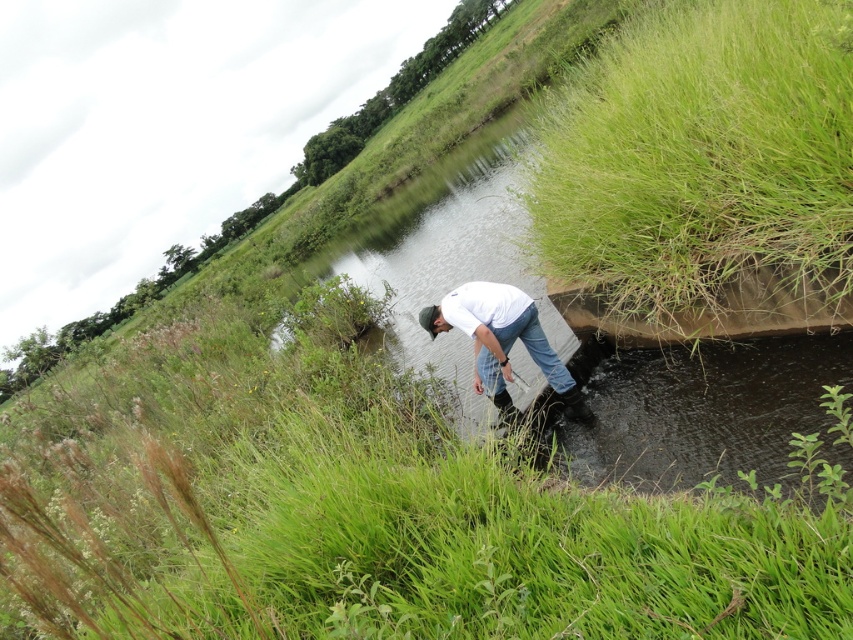
From the picture: You are a photographer trying to capture the scene of the person by the water. To ensure both the white matte shirt at center and the blue denim jeans at lower center are visible in the frame, which part of the person should you focus on?

You should focus on the white matte shirt at center because it is positioned on the left side of the blue denim jeans at lower center, making both elements visible in the frame.

You are a hiker who wants to cross the water body in the scene. You see the green grassy bank at upper right and the blue denim jeans at lower center. Which direction should you head towards to reach the bank?

You should head towards the green grassy bank at upper right because it is located above the blue denim jeans at lower center, indicating it is a higher elevation and likely the bank area.